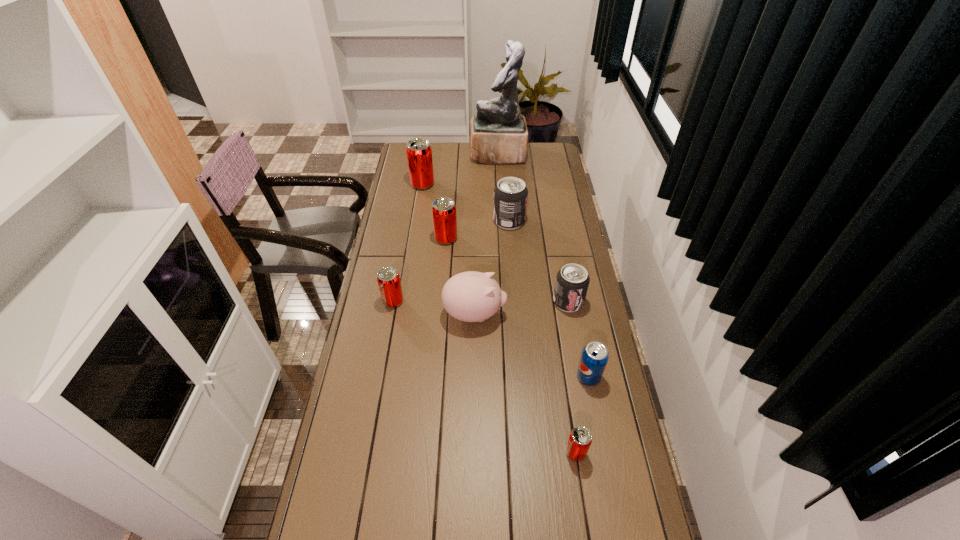
I want to click on the smaller black soda can, so (x=572, y=281).

Find the location of a particular element. The width and height of the screenshot is (960, 540). the second nearest red soda can is located at coordinates (388, 278).

Locate an element on the screen. The width and height of the screenshot is (960, 540). the sixth farthest soda can is located at coordinates point(594,358).

Image resolution: width=960 pixels, height=540 pixels. I want to click on blue pop soda, so 594,358.

Find the location of a particular element. Image resolution: width=960 pixels, height=540 pixels. the nearest object is located at coordinates (580, 439).

Find the location of `the rightmost red soda can`. the rightmost red soda can is located at coordinates (580, 439).

Locate an element on the screen. vacant space located 0.170m in a relaxed pose on the tallest object is located at coordinates (439, 154).

You are a GUI agent. You are given a task and a screenshot of the screen. Output one action in this format:
    pyautogui.click(x=<x>, y=<y>)
    Task: Click on the vacant space located 0.160m in a relaxed pose on the tallest object
    This screenshot has width=960, height=540.
    Given the screenshot: What is the action you would take?
    pyautogui.click(x=441, y=154)

Image resolution: width=960 pixels, height=540 pixels. I want to click on free space located 0.380m in a relaxed pose on the tallest object, so click(x=400, y=154).

Where is `vacant space located 0.130m on the front of the biggest red soda can`? Image resolution: width=960 pixels, height=540 pixels. vacant space located 0.130m on the front of the biggest red soda can is located at coordinates (419, 208).